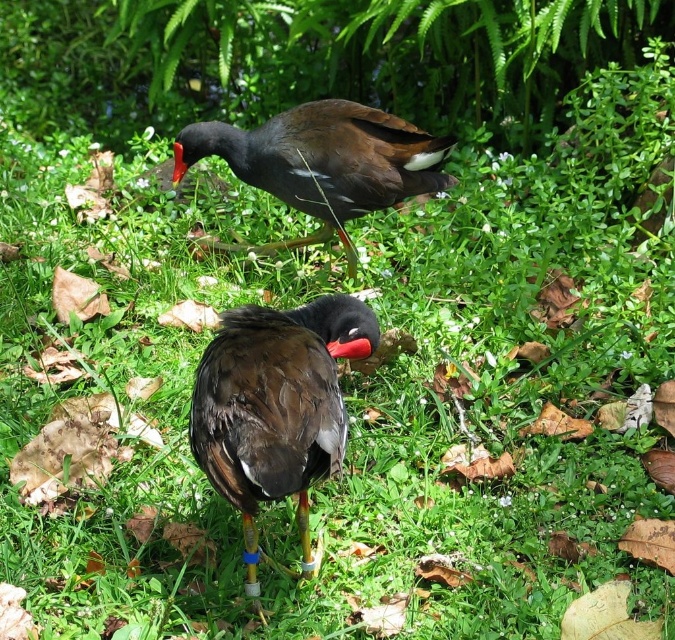
Does dark brown feathers at center have a lesser height compared to red matte beak at center?

Incorrect, dark brown feathers at center's height does not fall short of red matte beak at center's.

Measure the distance between point (323, 422) and camera.

Point (323, 422) and camera are 1.68 meters apart.

Is point (286, 369) behind point (171, 145)?

No, (286, 369) is in front of (171, 145).

Locate an element on the screen. This screenshot has width=675, height=640. dark brown feathers at center is located at coordinates (275, 406).

Describe the element at coordinates (325, 163) in the screenshot. I see `shiny brown bird at upper center` at that location.

Which of these two, shiny brown bird at upper center or red matte beak at center, stands taller?

Standing taller between the two is shiny brown bird at upper center.

Which is in front, point (265, 161) or point (182, 148)?

Point (182, 148)

The height and width of the screenshot is (640, 675). Find the location of `shiny brown bird at upper center`. shiny brown bird at upper center is located at coordinates (325, 163).

Between dark brown feathers at center and shiny brown bird at upper center, which one has less height?

shiny brown bird at upper center is shorter.

What do you see at coordinates (275, 406) in the screenshot? The width and height of the screenshot is (675, 640). I see `dark brown feathers at center` at bounding box center [275, 406].

Who is more forward, (302, 358) or (373, 184)?

Point (302, 358) is in front.

You are a GUI agent. You are given a task and a screenshot of the screen. Output one action in this format:
    pyautogui.click(x=<x>, y=<y>)
    Task: Click on the dark brown feathers at center
    The height and width of the screenshot is (640, 675).
    Given the screenshot: What is the action you would take?
    pyautogui.click(x=275, y=406)